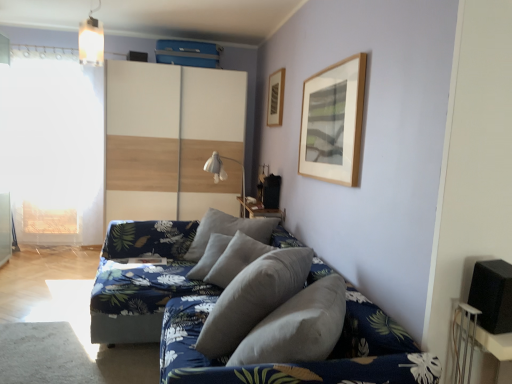
Question: From a real-world perspective, is white plastic table at lower right, which is the 2th table in left-to-right order, physically located above or below white matte window screen at left?

Choices:
 (A) below
 (B) above

Answer: (A)

Question: Is white plastic table at lower right, marked as the 1th table in a front-to-back arrangement, to the left or to the right of white matte window screen at left in the image?

Choices:
 (A) left
 (B) right

Answer: (B)

Question: Estimate the real-world distances between objects in this image. Which object is farther from the wooden table at center, which ranks as the first table in top-to-bottom order?

Choices:
 (A) black matte speaker at right
 (B) blue floral fabric couch at center
 (C) metallic pendant light at upper center
 (D) gray fabric pillow at center, the second pillow viewed from the back
 (E) white fabric lampshade at center

Answer: (A)

Question: Estimate the real-world distances between objects in this image. Which object is closer to the white plastic table at lower right, the 1th table from the bottom?

Choices:
 (A) black matte speaker at right
 (B) white wood dresser at center
 (C) metallic pendant light at upper center
 (D) wooden picture frame at upper center
 (E) gray fabric pillow at center, placed as the 1th pillow when sorted from front to back

Answer: (A)